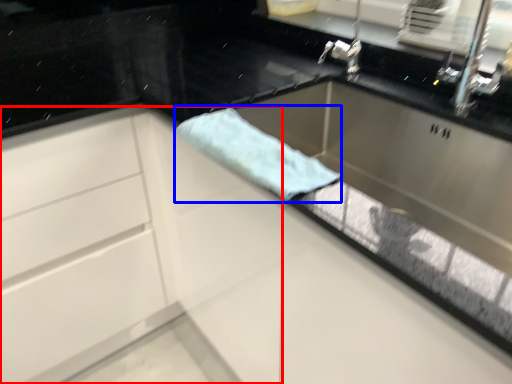
Question: Among these objects, which one is farthest to the camera, cabinetry (highlighted by a red box) or beach towel (highlighted by a blue box)?

Choices:
 (A) cabinetry
 (B) beach towel

Answer: (A)